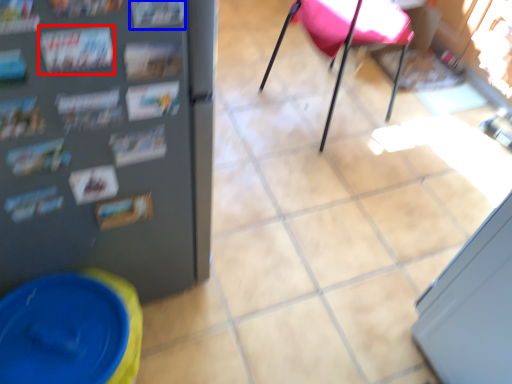
Question: Which object appears closest to the camera in this image, magazine (highlighted by a red box) or magazine (highlighted by a blue box)?

Choices:
 (A) magazine
 (B) magazine

Answer: (B)